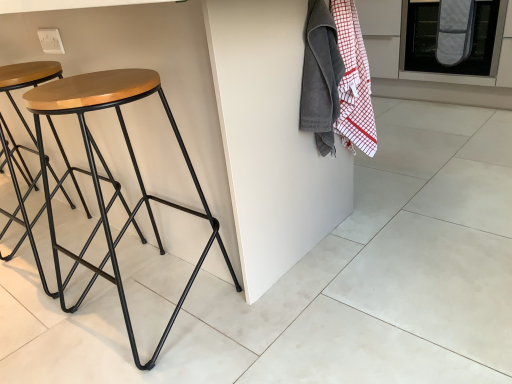
Identify the location of free location above white matte tile at lower right (from a real-world perspective). (393, 295).